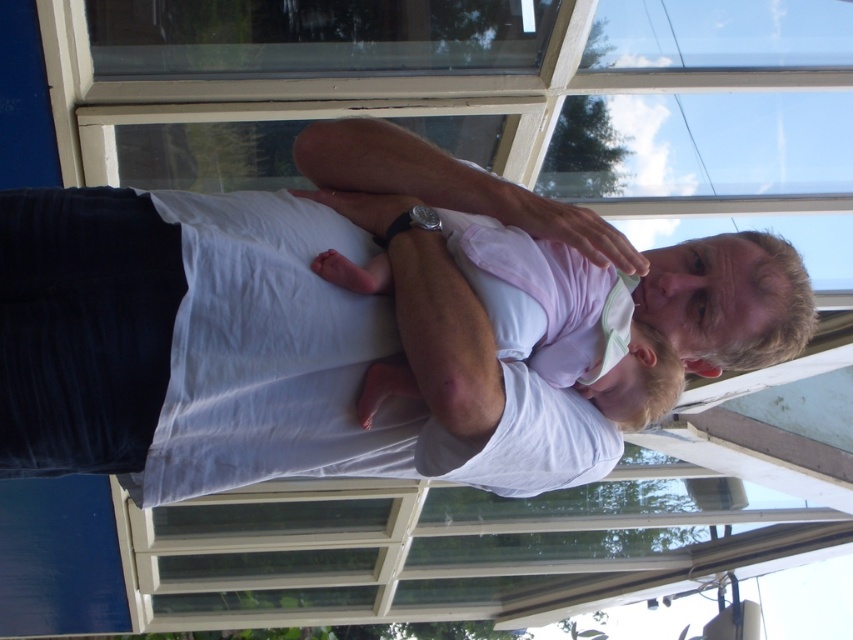
Is white cotton shirt at center below pink fabric baby at center?

Actually, white cotton shirt at center is above pink fabric baby at center.

Is white cotton shirt at center bigger than pink fabric baby at center?

Indeed, white cotton shirt at center has a larger size compared to pink fabric baby at center.

What do you see at coordinates (287, 330) in the screenshot?
I see `white cotton shirt at center` at bounding box center [287, 330].

The image size is (853, 640). I want to click on white cotton shirt at center, so click(287, 330).